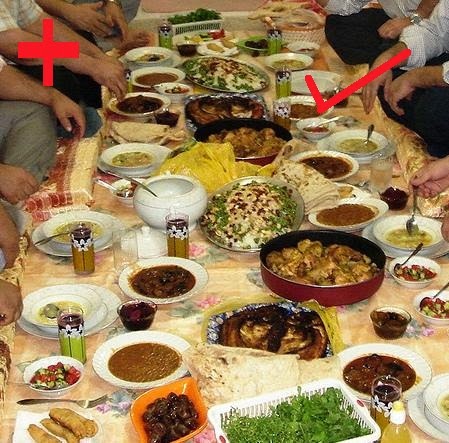
The width and height of the screenshot is (449, 443). In order to click on bottle of juice in this screenshot , I will do `click(400, 435)`.